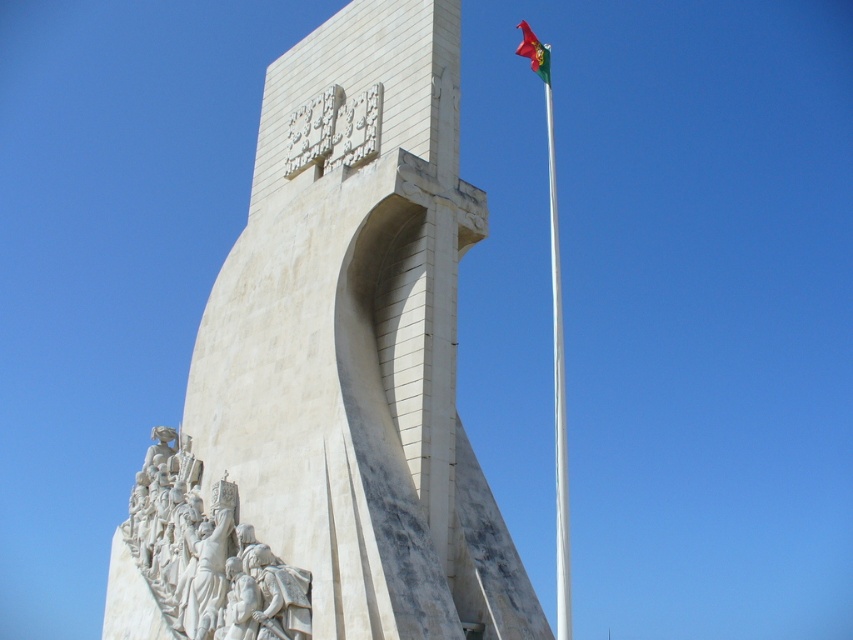
You are an architect examining the monument. You notice the white marble relief at lower left and the red fabric flag at upper right. Which object is located to the left of the other?

The white marble relief at lower left is positioned on the left side of red fabric flag at upper right.

You are standing in front of the monument and want to take a photo that includes both the flagpole and the sculptural relief. Which point, point (421,333) or point (254,609), is closer to your position?

Point (421,333) is further to the camera than point (254,609), so point (254,609) is closer to your position.

You are standing in front of the monument and want to take a photo that includes both the white marble monument at center and the white marble relief at lower left. Based on their positions, which object should you position to your left side in the camera frame?

The white marble relief at lower left should be positioned to your left side in the camera frame because the white marble monument at center is to the right of it.